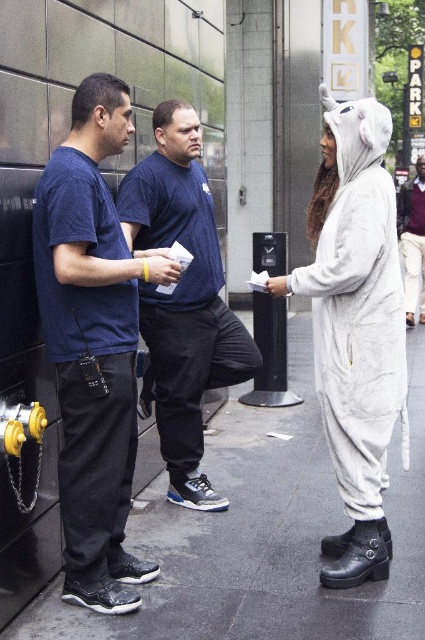
Is black rubber pavement at lower center wider than dark blue t-shirt at center?

Yes.

Is black rubber pavement at lower center below dark blue t-shirt at center?

Indeed, black rubber pavement at lower center is positioned under dark blue t-shirt at center.

The image size is (425, 640). In order to click on black rubber pavement at lower center in this screenshot , I will do click(265, 536).

Between dark blue t-shirt at left and white plush onesie at right, which one appears on the left side from the viewer's perspective?

dark blue t-shirt at left

Which is in front, point (107, 577) or point (343, 394)?

Positioned in front is point (107, 577).

Who is more distant from viewer, (90, 266) or (354, 305)?

Point (354, 305)

Identify the location of dark blue t-shirt at left. This screenshot has width=425, height=640. (93, 344).

Who is taller, dark blue t-shirt at left or dark blue t-shirt at center?

Standing taller between the two is dark blue t-shirt at center.

Who is more distant from viewer, (90, 83) or (153, 288)?

Positioned behind is point (153, 288).

Is point (67, 518) in front of point (183, 348)?

Yes, it is.

Locate an element on the screen. dark blue t-shirt at left is located at coordinates (93, 344).